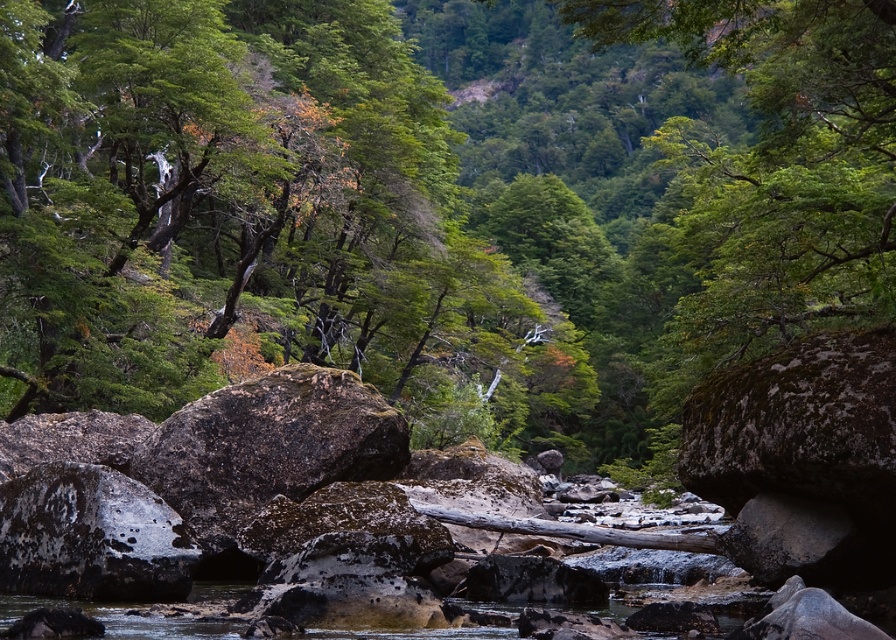
Question: Observing the image, what is the correct spatial positioning of mossy granite boulder at center-left in reference to speckled gray rock at center-left?

Choices:
 (A) right
 (B) left

Answer: (A)

Question: Does mossy granite boulder at center-left appear under speckled gray rock at center-left?

Choices:
 (A) yes
 (B) no

Answer: (B)

Question: Among these objects, which one is nearest to the camera?

Choices:
 (A) speckled gray rock at center-left
 (B) mossy granite boulder at center-left

Answer: (A)

Question: Is mossy granite boulder at center-left thinner than speckled gray rock at center-left?

Choices:
 (A) no
 (B) yes

Answer: (A)